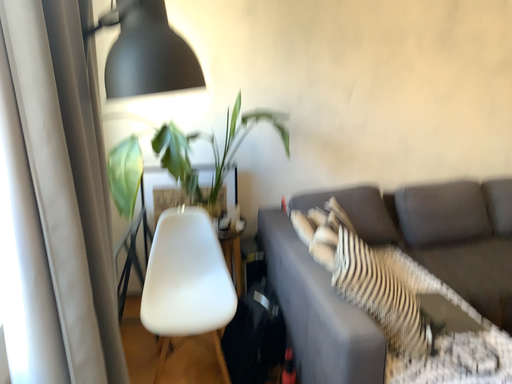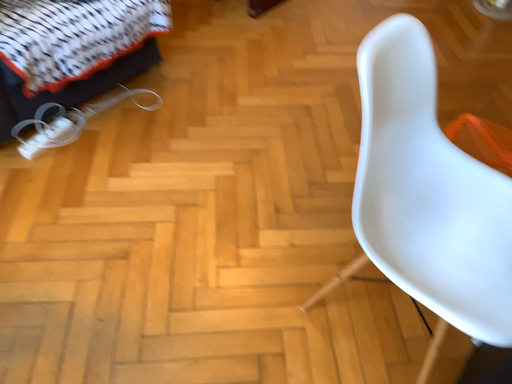
Question: Which way did the camera rotate in the video?

Choices:
 (A) rotated left
 (B) rotated right

Answer: (B)